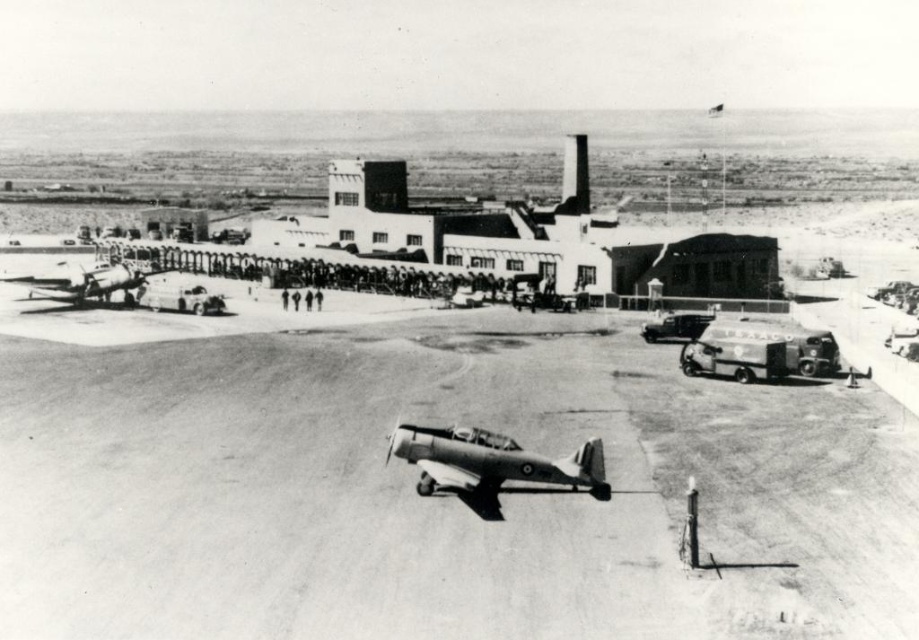
Question: Which point appears farthest from the camera in this image?

Choices:
 (A) (430, 477)
 (B) (893, 580)
 (C) (129, 284)

Answer: (C)

Question: Is metallic gray airplane at center bigger than metallic silver airplane at left?

Choices:
 (A) no
 (B) yes

Answer: (A)

Question: Which object is positioned farthest from the smooth asphalt tarmac at center?

Choices:
 (A) metallic silver airplane at left
 (B) metallic gray airplane at center

Answer: (A)

Question: From the image, what is the correct spatial relationship of metallic gray airplane at center in relation to metallic silver airplane at left?

Choices:
 (A) below
 (B) above

Answer: (A)

Question: Based on their relative distances, which object is farther from the smooth asphalt tarmac at center?

Choices:
 (A) metallic silver airplane at left
 (B) metallic gray airplane at center

Answer: (A)

Question: Does metallic gray airplane at center appear under metallic silver airplane at left?

Choices:
 (A) yes
 (B) no

Answer: (A)